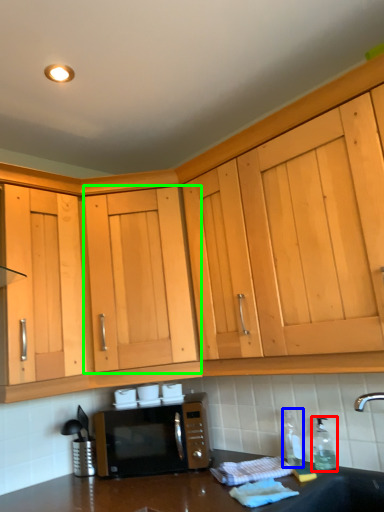
Question: Estimate the real-world distances between objects in this image. Which object is closer to bottle (highlighted by a red box), bottle (highlighted by a blue box) or cabinetry (highlighted by a green box)?

Choices:
 (A) bottle
 (B) cabinetry

Answer: (A)